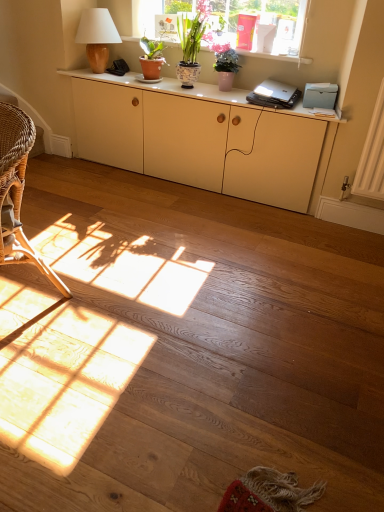
Question: Is black plastic laptop at center in front of or behind matte wood lamp at upper left in the image?

Choices:
 (A) behind
 (B) front

Answer: (B)

Question: Is black plastic laptop at center bigger or smaller than matte wood lamp at upper left?

Choices:
 (A) big
 (B) small

Answer: (B)

Question: Which is nearer to the matte ceramic pots at upper center?

Choices:
 (A) black plastic laptop at center
 (B) matte cream cabinet at center
 (C) matte wood lamp at upper left
 (D) textured ceramic pot at upper center, the 2th houseplant in the left-to-right sequence
 (E) matte white cabinet at upper center

Answer: (A)

Question: Which object is positioned closest to the matte ceramic pots at upper center?

Choices:
 (A) matte terracotta pot at upper center, positioned as the 3th houseplant in right-to-left order
 (B) textured ceramic pot at upper center, the 2th houseplant in the left-to-right sequence
 (C) black plastic laptop at center
 (D) matte white cabinet at upper center
 (E) matte wood lamp at upper left

Answer: (C)